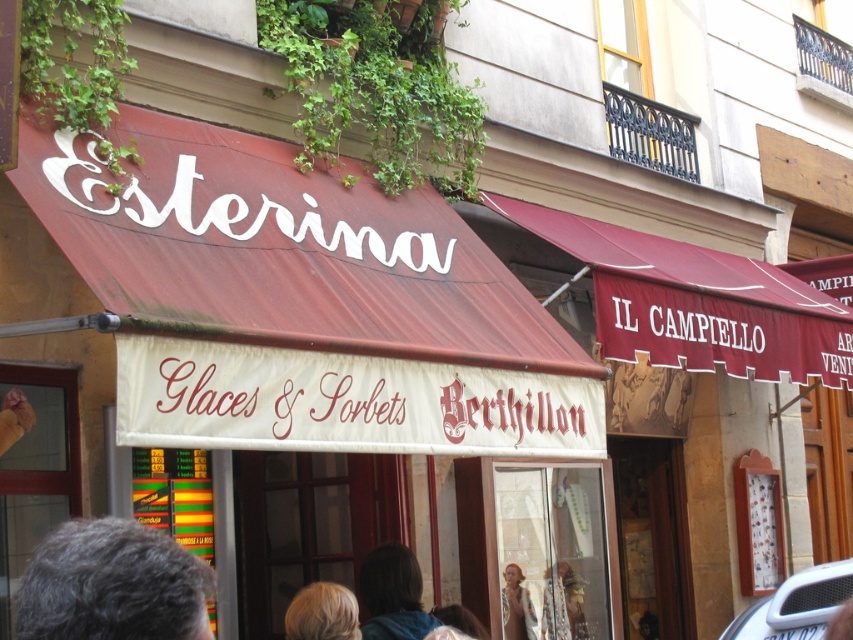
Is brown hair at center shorter than multicolored fabric at lower center?

Correct, brown hair at center is not as tall as multicolored fabric at lower center.

Is point (425, 632) positioned after point (506, 600)?

That is False.

Is point (408, 588) positioned before point (514, 620)?

Yes, it is in front of point (514, 620).

At what (x,y) coordinates should I click in order to perform the action: click on brown hair at center. Please return your answer as a coordinate pair (x, y). Looking at the image, I should click on (393, 595).

Does blonde hair at lower center have a larger size compared to multicolored fabric at lower center?

No.

Is blonde hair at lower center to the left of multicolored fabric at lower center from the viewer's perspective?

Yes, blonde hair at lower center is to the left of multicolored fabric at lower center.

Is point (347, 616) positioned after point (531, 620)?

That is False.

Find the location of a particular element. The image size is (853, 640). blonde hair at lower center is located at coordinates (322, 612).

Who is lower down, gray hair at lower left or blonde hair at lower center?

blonde hair at lower center

Can you confirm if gray hair at lower left is smaller than blonde hair at lower center?

No, gray hair at lower left is not smaller than blonde hair at lower center.

What do you see at coordinates (112, 586) in the screenshot? The image size is (853, 640). I see `gray hair at lower left` at bounding box center [112, 586].

Locate an element on the screen. This screenshot has width=853, height=640. gray hair at lower left is located at coordinates (112, 586).